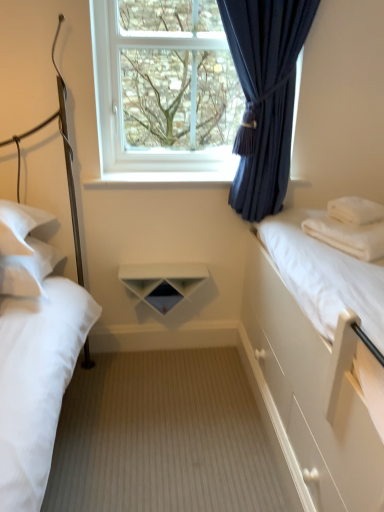
The height and width of the screenshot is (512, 384). I want to click on empty space that is ontop of white soft pillow at right, the 3th pillow when ordered from left to right (from a real-world perspective), so click(x=359, y=202).